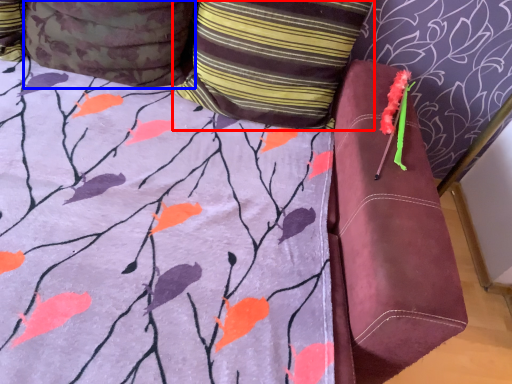
Question: Which object appears farthest to the camera in this image, pillow (highlighted by a red box) or pillow (highlighted by a blue box)?

Choices:
 (A) pillow
 (B) pillow

Answer: (A)